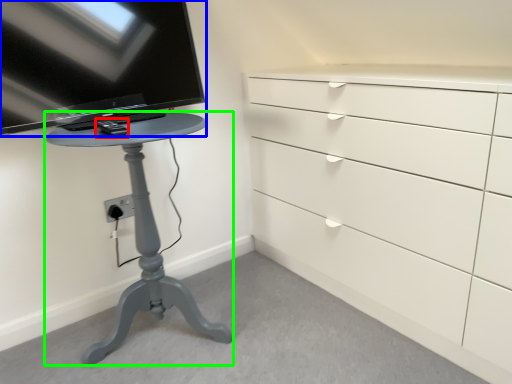
Question: Based on their relative distances, which object is farther from equipment (highlighted by a red box)? Choose from television (highlighted by a blue box) and furniture (highlighted by a green box).

Choices:
 (A) television
 (B) furniture

Answer: (B)